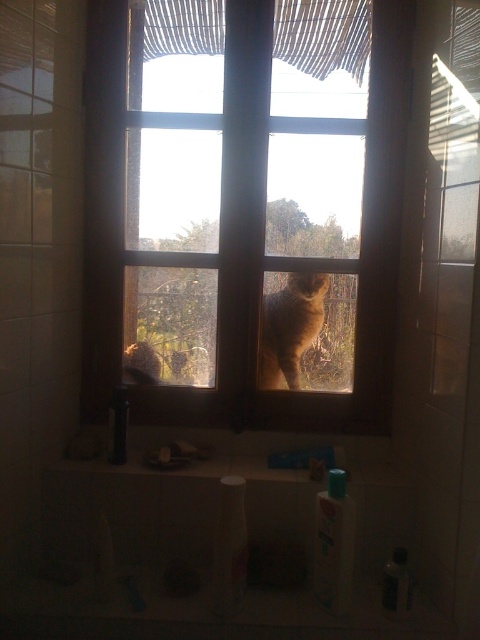
Question: Which point is farther to the camera?

Choices:
 (A) white woven curtain at upper center
 (B) fuzzy brown cat at center
 (C) wooden frame at center

Answer: (B)

Question: Which object appears closest to the camera in this image?

Choices:
 (A) white woven curtain at upper center
 (B) wooden frame at center

Answer: (A)

Question: Does white woven curtain at upper center have a smaller size compared to fuzzy brown cat at center?

Choices:
 (A) yes
 (B) no

Answer: (B)

Question: Which object appears closest to the camera in this image?

Choices:
 (A) white woven curtain at upper center
 (B) fuzzy brown cat at center
 (C) wooden frame at center

Answer: (A)

Question: Is wooden frame at center smaller than fuzzy brown cat at center?

Choices:
 (A) yes
 (B) no

Answer: (B)

Question: Does wooden frame at center appear under fuzzy brown cat at center?

Choices:
 (A) no
 (B) yes

Answer: (A)